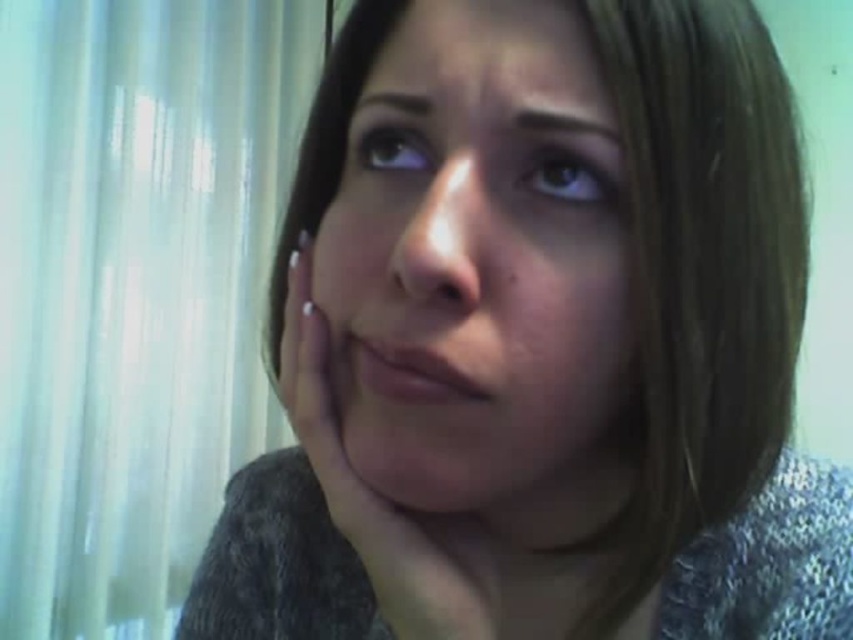
Does white sheer curtain at left have a larger size compared to nail polish at center?

Indeed, white sheer curtain at left has a larger size compared to nail polish at center.

Does white sheer curtain at left appear on the left side of nail polish at center?

Yes, white sheer curtain at left is to the left of nail polish at center.

Based on the photo, who is more distant from viewer, [195,81] or [433,570]?

Point [195,81]

In order to click on white sheer curtain at left in this screenshot , I will do `click(134, 289)`.

Which of these two, smooth skin face at center or nail polish at center, stands shorter?

With less height is nail polish at center.

Which of these two, smooth skin face at center or nail polish at center, stands taller?

smooth skin face at center

The height and width of the screenshot is (640, 853). What are the coordinates of `smooth skin face at center` in the screenshot? It's located at (480, 266).

Where is `smooth skin face at center`? This screenshot has width=853, height=640. smooth skin face at center is located at coordinates (480, 266).

Can you confirm if white sheer curtain at left is smaller than smooth skin face at center?

Actually, white sheer curtain at left might be larger than smooth skin face at center.

Which is in front, point (44, 205) or point (488, 296)?

Positioned in front is point (488, 296).

At what (x,y) coordinates should I click in order to perform the action: click on white sheer curtain at left. Please return your answer as a coordinate pair (x, y). Image resolution: width=853 pixels, height=640 pixels. Looking at the image, I should click on click(x=134, y=289).